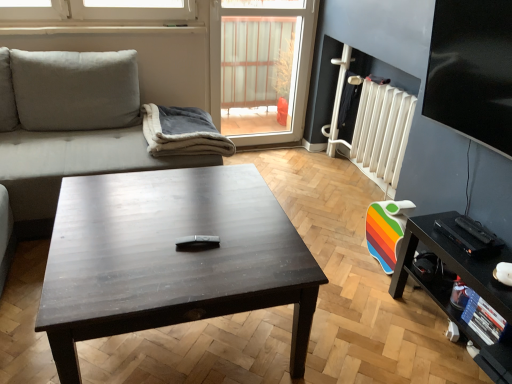
I want to click on free space to the left of black glossy tv stand at lower right, so click(370, 331).